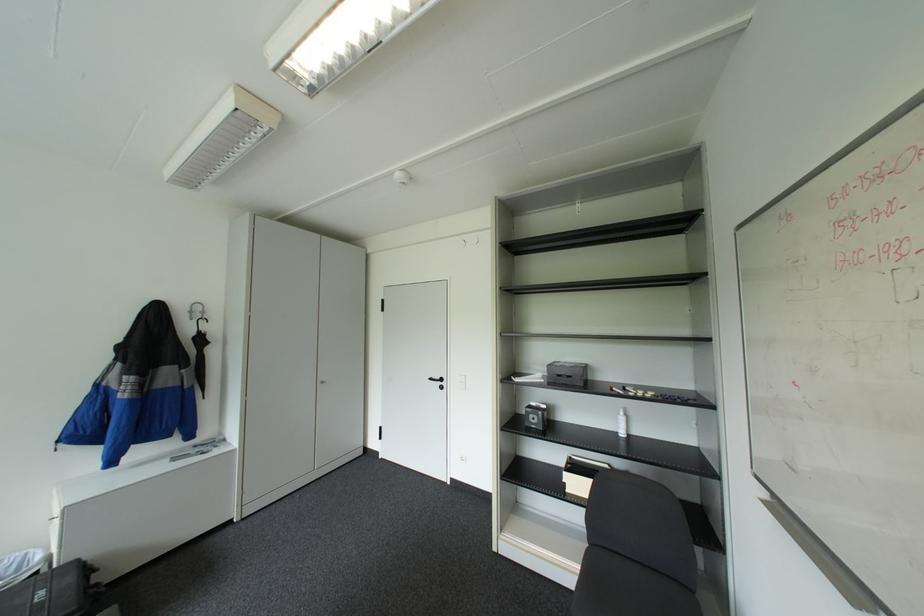
What do you see at coordinates (536, 416) in the screenshot?
I see `the black box dial` at bounding box center [536, 416].